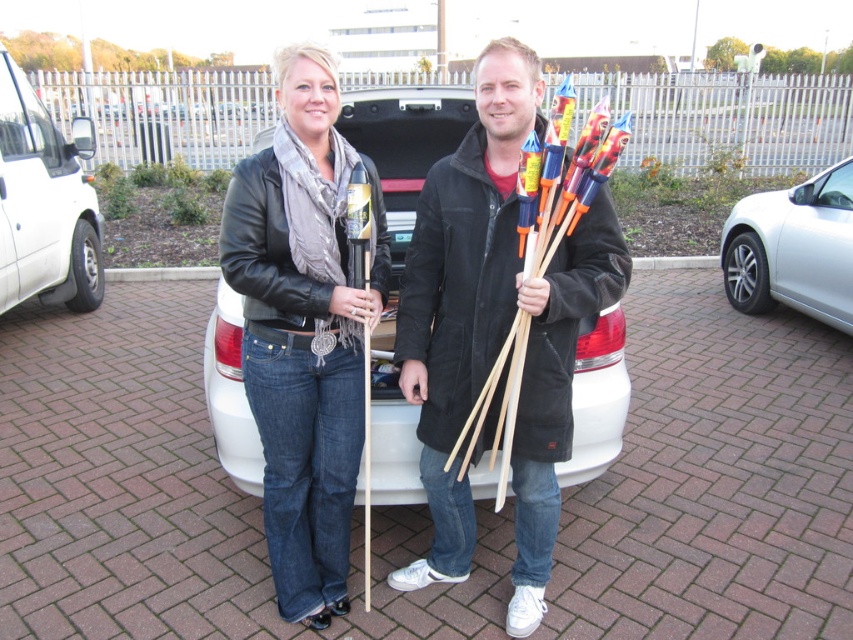
Question: Which point is farther to the camera?

Choices:
 (A) (572, 404)
 (B) (21, 259)
 (C) (840, 307)
 (D) (312, 184)

Answer: (C)

Question: Can you confirm if white matte car at center is smaller than white matte van at left?

Choices:
 (A) no
 (B) yes

Answer: (B)

Question: Which object is the closest to the matte black jacket at center?

Choices:
 (A) white matte car at center
 (B) silver metallic car at right
 (C) white matte van at left
 (D) black suede coat at center

Answer: (D)

Question: Does black suede coat at center have a lesser width compared to white matte car at center?

Choices:
 (A) no
 (B) yes

Answer: (A)

Question: Which point is farther to the camera?

Choices:
 (A) black suede coat at center
 (B) matte black jacket at center
 (C) silver metallic car at right
 (D) white matte car at center

Answer: (C)

Question: Does matte black jacket at center appear over silver metallic car at right?

Choices:
 (A) yes
 (B) no

Answer: (B)